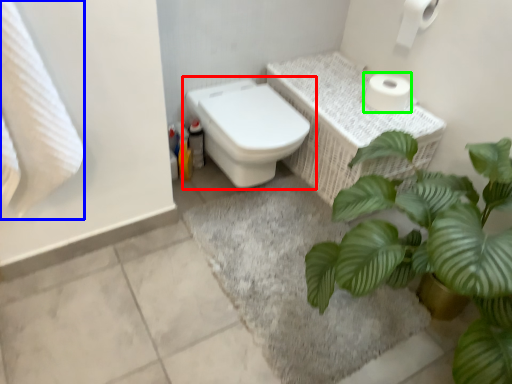
Question: Which object is the closest to the toilet (highlighted by a red box)? Choose among these: bath towel (highlighted by a blue box) or toilet paper (highlighted by a green box).

Choices:
 (A) bath towel
 (B) toilet paper

Answer: (B)